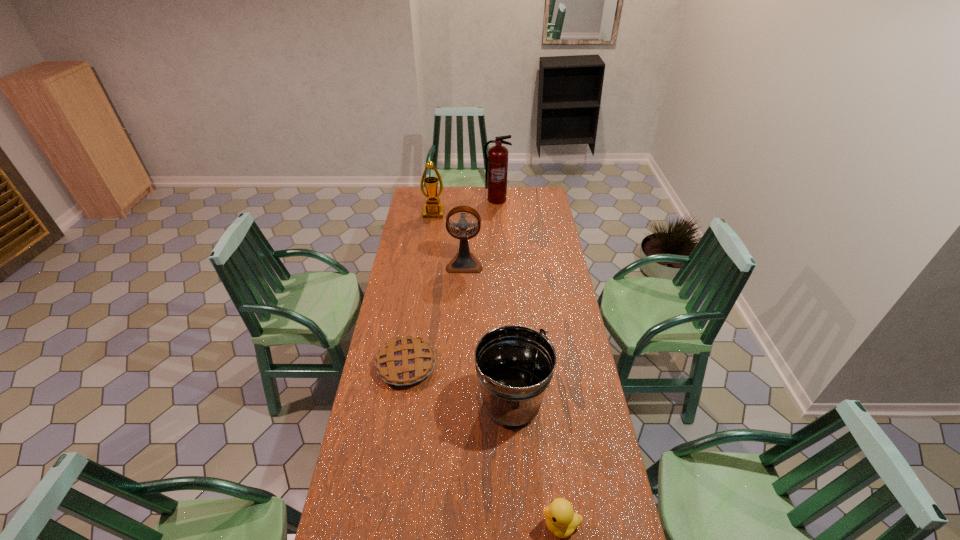
At what (x,y) coordinates should I click in order to perform the action: click on the tallest object. Please return your answer as a coordinate pair (x, y). The height and width of the screenshot is (540, 960). Looking at the image, I should click on (496, 165).

Locate an element on the screen. the farthest object is located at coordinates (496, 165).

The width and height of the screenshot is (960, 540). I want to click on award, so click(x=433, y=209).

You are a GUI agent. You are given a task and a screenshot of the screen. Output one action in this format:
    pyautogui.click(x=<x>, y=<y>)
    Task: Click on the fourth nearest object
    This screenshot has width=960, height=540.
    Given the screenshot: What is the action you would take?
    pyautogui.click(x=464, y=261)

I want to click on bucket, so click(515, 364).

This screenshot has height=540, width=960. In order to click on pie in this screenshot , I will do `click(405, 361)`.

Locate an element on the screen. vacant space positioned 0.390m on the side of the farthest object with the handle and hose is located at coordinates (499, 241).

The height and width of the screenshot is (540, 960). Find the location of `free spot located on the front-facing side of the award`. free spot located on the front-facing side of the award is located at coordinates (429, 244).

The width and height of the screenshot is (960, 540). Identify the location of vacant space situated 0.220m on the front-facing side of the third farthest object. (463, 303).

Find the location of a particular element. The width and height of the screenshot is (960, 540). vacant area situated on the back of the bucket is located at coordinates (508, 350).